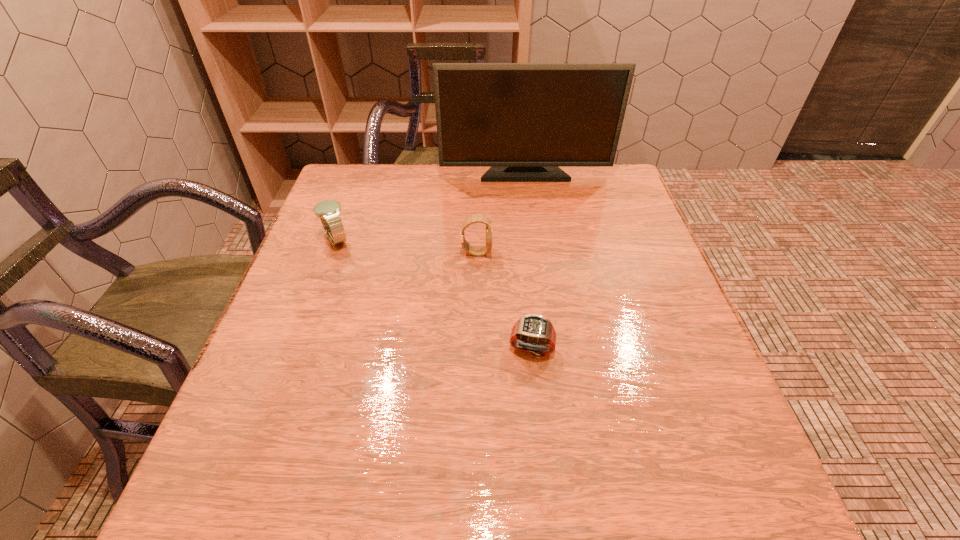
In order to click on object at the far edge in this screenshot , I will do `click(523, 120)`.

The width and height of the screenshot is (960, 540). I want to click on object positioned at the left edge, so click(328, 211).

The width and height of the screenshot is (960, 540). What are the coordinates of `object that is positioned at the right edge` in the screenshot? It's located at (523, 120).

You are a GUI agent. You are given a task and a screenshot of the screen. Output one action in this format:
    pyautogui.click(x=<x>, y=<y>)
    Task: Click on the object at the far right corner
    This screenshot has width=960, height=540.
    Given the screenshot: What is the action you would take?
    pyautogui.click(x=523, y=120)

You are a GUI agent. You are given a task and a screenshot of the screen. Output one action in this format:
    pyautogui.click(x=<x>, y=<y>)
    Task: Click on the blank space at the far edge of the desktop
    The height and width of the screenshot is (540, 960).
    Given the screenshot: What is the action you would take?
    pyautogui.click(x=510, y=197)

Locate an element on the screen. vacant point at the near edge is located at coordinates click(x=600, y=504).

Where is `vacant position at the left edge of the desktop`? The width and height of the screenshot is (960, 540). vacant position at the left edge of the desktop is located at coordinates (248, 417).

In order to click on free point at the right edge in this screenshot , I will do `click(713, 401)`.

In the image, there is a desktop. Where is `free region at the far left corner`? The width and height of the screenshot is (960, 540). free region at the far left corner is located at coordinates (344, 207).

Locate an element on the screen. vacant region between the rightmost watch and the monitor is located at coordinates (528, 260).